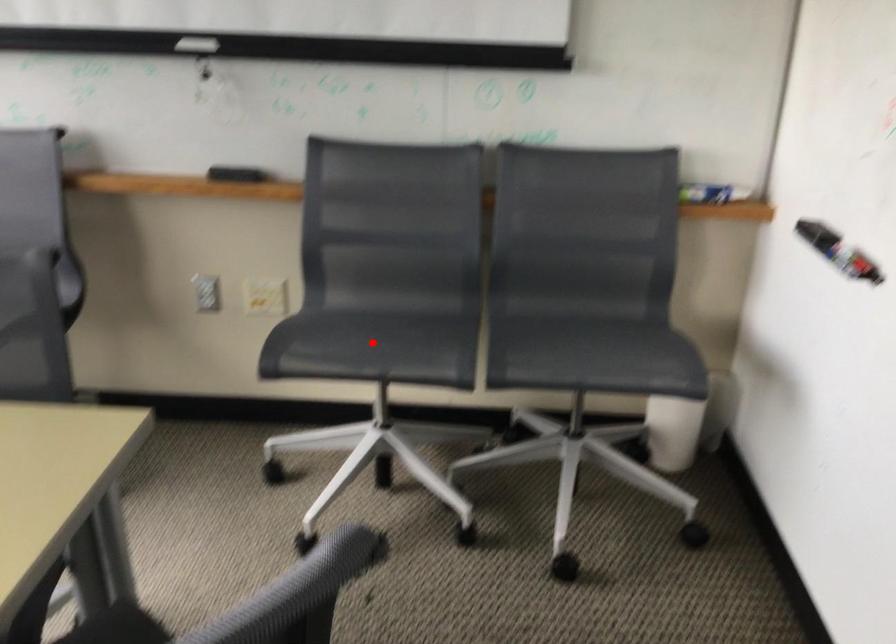
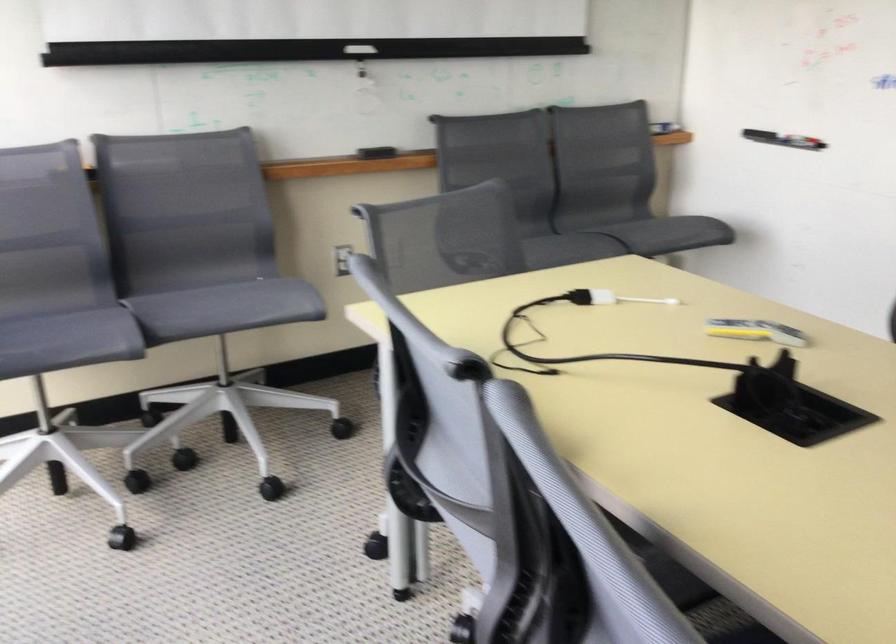
Question: I am providing you with two images of the same scene from different viewpoints. Given a red point in image1, look at the same physical point in image2. Is it:

Choices:
 (A) Closer to the viewpoint
 (B) Farther from the viewpoint

Answer: (B)